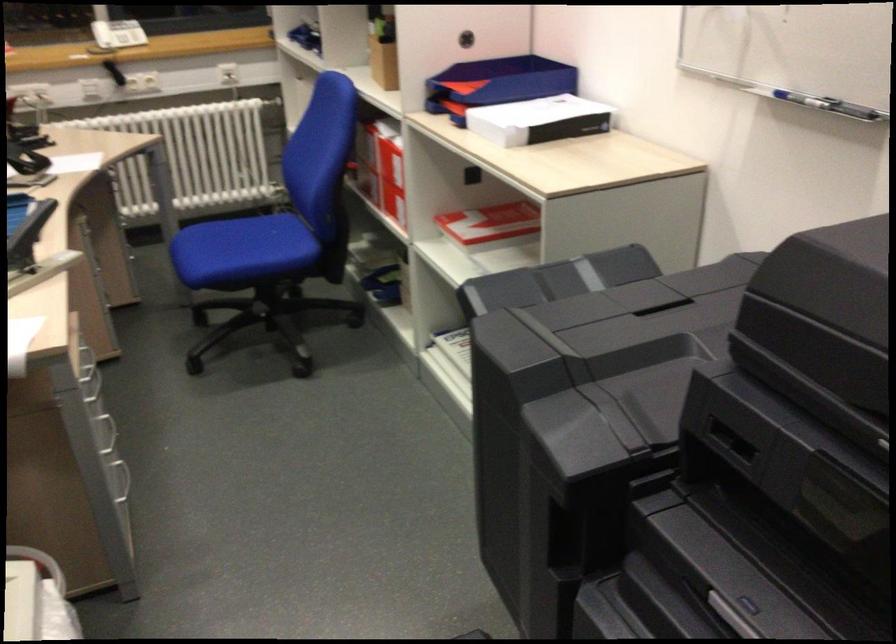
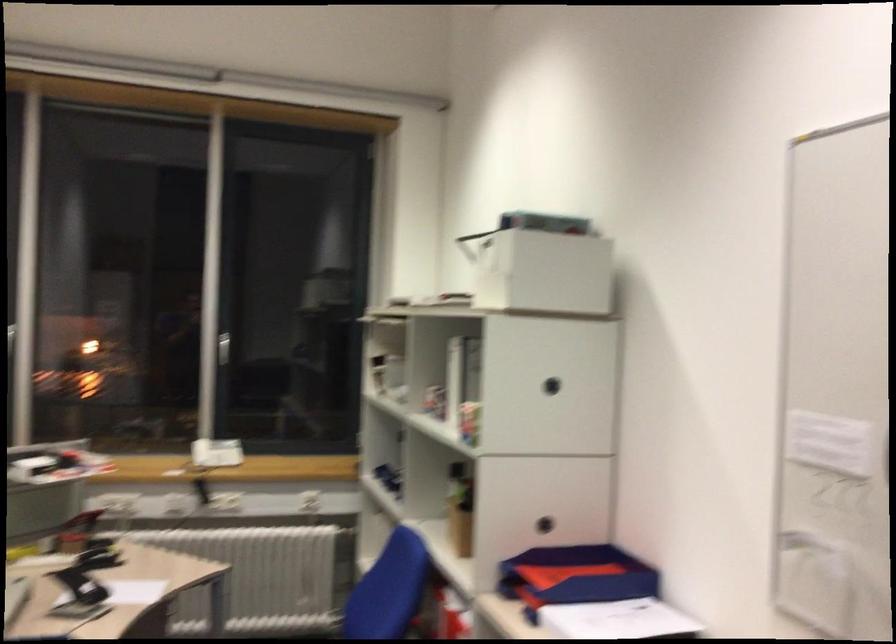
Which direction would the cameraman need to move to produce the second image?

The cameraman moved toward left, forward.